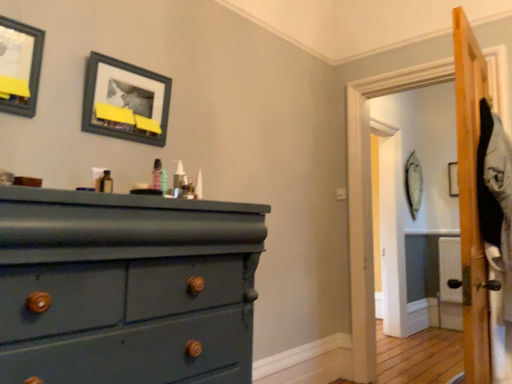
Question: Is matte black picture frame at upper left, the first picture frame positioned from the left, not within matte black picture frame at upper center, which ranks as the 2th picture frame in left-to-right order?

Choices:
 (A) yes
 (B) no

Answer: (A)

Question: From the image's perspective, would you say matte black picture frame at upper left, the first picture frame positioned from the left, is positioned over matte black picture frame at upper center, which ranks as the 2th picture frame in left-to-right order?

Choices:
 (A) no
 (B) yes

Answer: (B)

Question: Does matte black picture frame at upper left, the 3th picture frame positioned from the back, touch matte black picture frame at upper center, which ranks as the 2th picture frame in left-to-right order?

Choices:
 (A) yes
 (B) no

Answer: (B)

Question: Does matte black picture frame at upper left, the 3th picture frame positioned from the back, have a lesser height compared to matte black picture frame at upper center, the second picture frame positioned from the front?

Choices:
 (A) no
 (B) yes

Answer: (A)

Question: Is matte black picture frame at upper left, the 3th picture frame positioned from the back, wider than matte black picture frame at upper center, which ranks as the 2th picture frame in left-to-right order?

Choices:
 (A) no
 (B) yes

Answer: (B)

Question: Is translucent plastic spray bottle at center, which appears as the 1th toiletry when viewed from the left, taller or shorter than teal matte wood dresser at left?

Choices:
 (A) short
 (B) tall

Answer: (A)

Question: Looking at their shapes, would you say translucent plastic spray bottle at center, which is the 2th toiletry in right-to-left order, is wider or thinner than teal matte wood dresser at left?

Choices:
 (A) wide
 (B) thin

Answer: (B)

Question: From a real-world perspective, is translucent plastic spray bottle at center, which is the 2th toiletry in right-to-left order, above or below teal matte wood dresser at left?

Choices:
 (A) below
 (B) above

Answer: (B)

Question: From the image's perspective, relative to teal matte wood dresser at left, is translucent plastic spray bottle at center, which is the 2th toiletry in right-to-left order, above or below?

Choices:
 (A) above
 (B) below

Answer: (A)

Question: Considering the positions of teal matte wood dresser at left and translucent plastic spray bottle at center, which appears as the 1th toiletry when viewed from the left, in the image, is teal matte wood dresser at left wider or thinner than translucent plastic spray bottle at center, which appears as the 1th toiletry when viewed from the left,?

Choices:
 (A) thin
 (B) wide

Answer: (B)

Question: Is point [183, 317] closer or farther from the camera than point [178, 165]?

Choices:
 (A) closer
 (B) farther

Answer: (A)

Question: Is teal matte wood dresser at left taller or shorter than translucent plastic spray bottle at center, which is the 2th toiletry in right-to-left order?

Choices:
 (A) tall
 (B) short

Answer: (A)

Question: Which is correct: teal matte wood dresser at left is inside translucent plastic spray bottle at center, which appears as the 1th toiletry when viewed from the left, or outside of it?

Choices:
 (A) inside
 (B) outside

Answer: (B)

Question: Do you think translucent plastic pump at center, acting as the second toiletry starting from the left, is within wooden picture frame at upper right, placed as the third picture frame when sorted from left to right, or outside of it?

Choices:
 (A) inside
 (B) outside

Answer: (B)

Question: In the image, is translucent plastic pump at center, acting as the first toiletry starting from the right, on the left side or the right side of wooden picture frame at upper right, the third picture frame when ordered from front to back?

Choices:
 (A) right
 (B) left

Answer: (B)